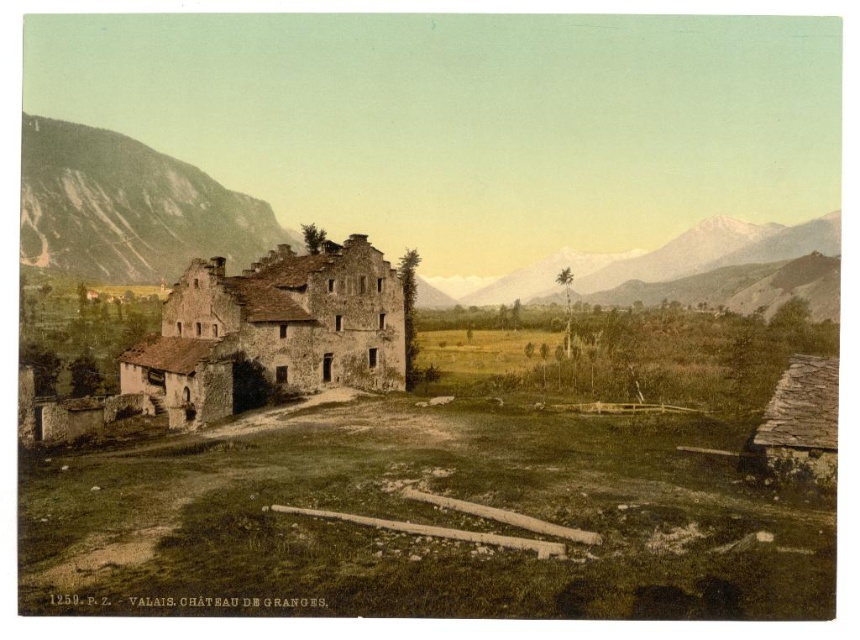
You are standing at the center of the Chateux de Granges scene. You want to take a photo of the rustic stone mountain at left. Which direction should you face to capture it in your view?

The rustic stone mountain at left is located at point (127, 208), so you should face towards the left side of the scene to capture it in your view.

You are a hiker planning to climb both the rustic stone mountain at left and the snowy granite mountain at upper right. Based on the scene, which mountain should you tackle first if you want to start with the taller one?

The rustic stone mountain at left is taller than the snowy granite mountain at upper right, so you should start by climbing the rustic stone mountain at left first.